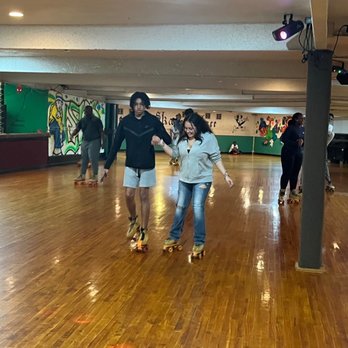
Image resolution: width=348 pixels, height=348 pixels. I want to click on lights, so click(x=282, y=33), click(x=339, y=71).